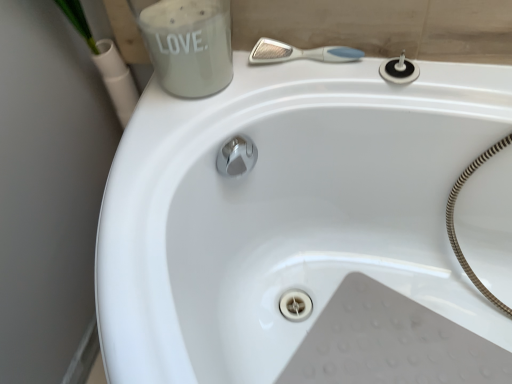
Question: Does white frosted glass jar at upper left appear on the left side of white plastic shower at upper center?

Choices:
 (A) no
 (B) yes

Answer: (B)

Question: From the image's perspective, is white frosted glass jar at upper left located beneath white plastic shower at upper center?

Choices:
 (A) no
 (B) yes

Answer: (A)

Question: Considering the relative positions of white frosted glass jar at upper left and white plastic shower at upper center in the image provided, is white frosted glass jar at upper left to the right of white plastic shower at upper center from the viewer's perspective?

Choices:
 (A) yes
 (B) no

Answer: (B)

Question: Is white frosted glass jar at upper left oriented away from white plastic shower at upper center?

Choices:
 (A) no
 (B) yes

Answer: (A)

Question: Can you confirm if white frosted glass jar at upper left is shorter than white plastic shower at upper center?

Choices:
 (A) yes
 (B) no

Answer: (B)

Question: Considering the positions of white plastic shower at upper center and black rubber drain at upper right in the image, is white plastic shower at upper center taller or shorter than black rubber drain at upper right?

Choices:
 (A) tall
 (B) short

Answer: (B)

Question: From a real-world perspective, is white plastic shower at upper center physically located above or below black rubber drain at upper right?

Choices:
 (A) above
 (B) below

Answer: (A)

Question: Do you think white plastic shower at upper center is within black rubber drain at upper right, or outside of it?

Choices:
 (A) inside
 (B) outside

Answer: (B)

Question: From the image's perspective, is white plastic shower at upper center positioned above or below black rubber drain at upper right?

Choices:
 (A) below
 (B) above

Answer: (B)

Question: From a real-world perspective, relative to white plastic shower at upper center, is black rubber drain at upper right vertically above or below?

Choices:
 (A) above
 (B) below

Answer: (B)

Question: Considering the positions of black rubber drain at upper right and white plastic shower at upper center in the image, is black rubber drain at upper right taller or shorter than white plastic shower at upper center?

Choices:
 (A) tall
 (B) short

Answer: (A)

Question: Is black rubber drain at upper right wider or thinner than white plastic shower at upper center?

Choices:
 (A) wide
 (B) thin

Answer: (A)

Question: Considering their positions, is black rubber drain at upper right located in front of or behind white plastic shower at upper center?

Choices:
 (A) front
 (B) behind

Answer: (A)

Question: From the image's perspective, is white frosted glass jar at upper left above or below black rubber drain at upper right?

Choices:
 (A) below
 (B) above

Answer: (B)

Question: Would you say white frosted glass jar at upper left is to the left or to the right of black rubber drain at upper right in the picture?

Choices:
 (A) right
 (B) left

Answer: (B)